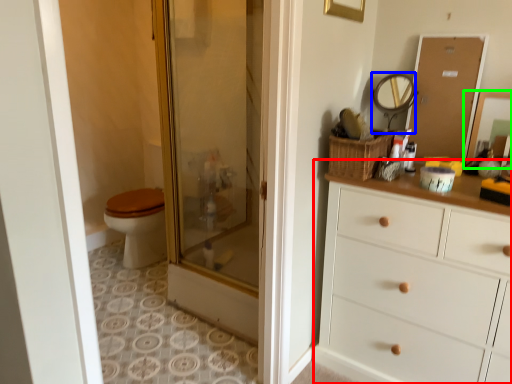
Question: Which object is the farthest from chest of drawers (highlighted by a red box)? Choose among these: mirror (highlighted by a blue box) or mirror (highlighted by a green box).

Choices:
 (A) mirror
 (B) mirror

Answer: (A)